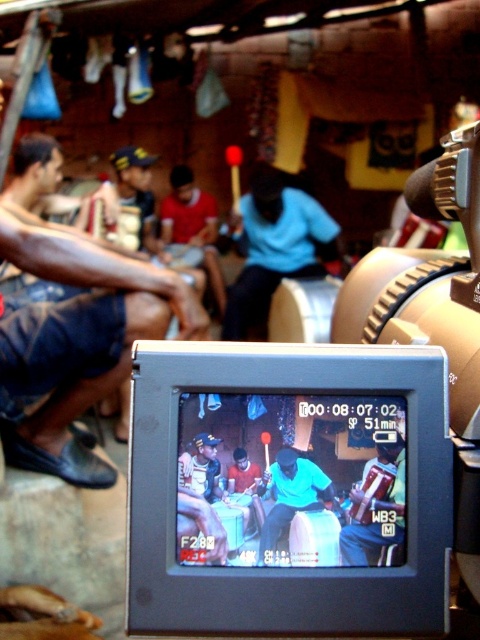
You are a director observing the video feed on the camera LCD screen. You notice two points marked on the screen at coordinates point [195,563] and point [61,264]. Which point is closer to the camera lens?

Point [195,563] is closer to the camera lens than point [61,264].

You are setting up equipment for a live stream and need to place the matte black video camera at center and the blue matte shirt at center on a shelf. The shelf has a width of 1 meter. Can both items fit side by side without overlapping?

The matte black video camera at center has a lesser width compared to blue matte shirt at center. Since the shelf is 1 meter wide, if the combined width of both items is less than or equal to 1 meter, they can fit. However, without knowing the exact widths, we cannot confirm. But since the camera is narrower, it might be possible if the shirt isn